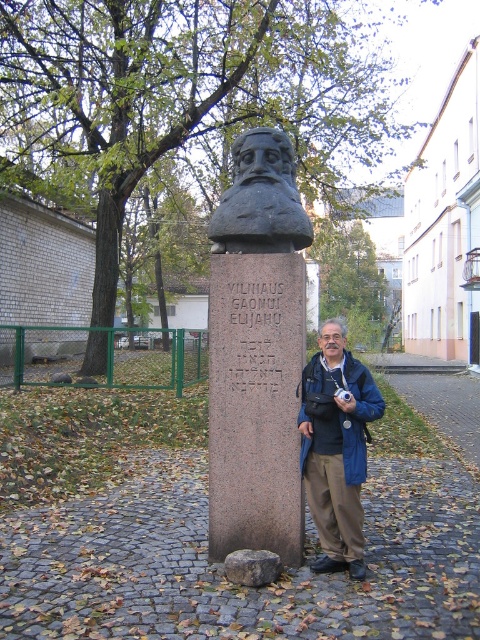
Locate an element on the screen. This screenshot has width=480, height=640. blue fabric jacket at center is located at coordinates (336, 448).

Is granite bust at center closer to the viewer compared to blue fabric jacket at center?

No, it is behind blue fabric jacket at center.

This screenshot has height=640, width=480. Identify the location of granite bust at center. (256, 352).

Does granite bust at center have a greater height compared to black stone bust at center?

A: Correct, granite bust at center is much taller as black stone bust at center.

Between granite bust at center and black stone bust at center, which one has more height?

Standing taller between the two is granite bust at center.

This screenshot has height=640, width=480. What are the coordinates of `granite bust at center` in the screenshot? It's located at (256, 352).